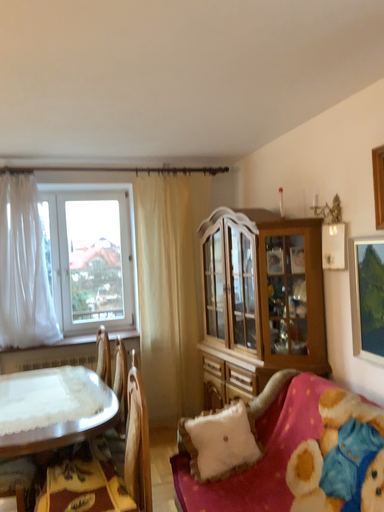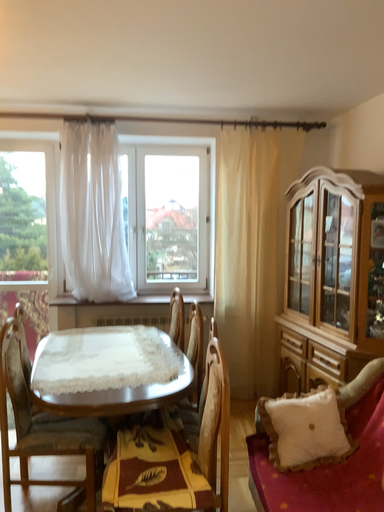
Question: Which way did the camera rotate in the video?

Choices:
 (A) rotated right
 (B) rotated left

Answer: (B)